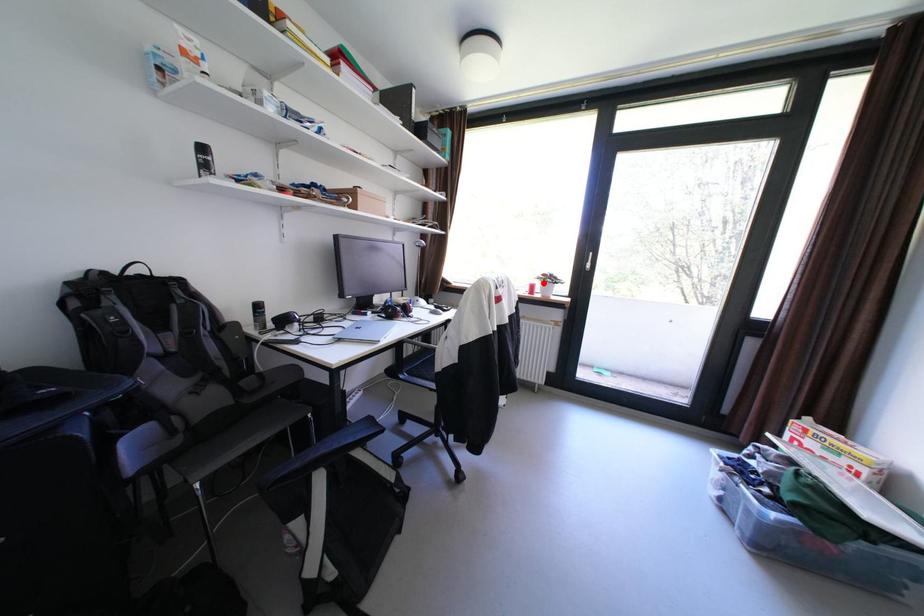
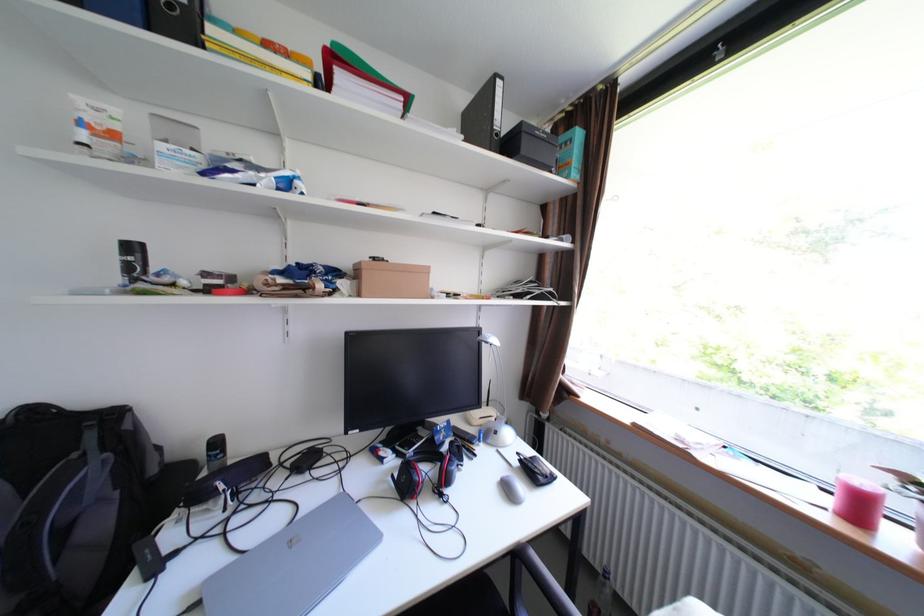
Locate, in the second image, the point that corresponds to the highlighted location in the first image.

(874, 484)